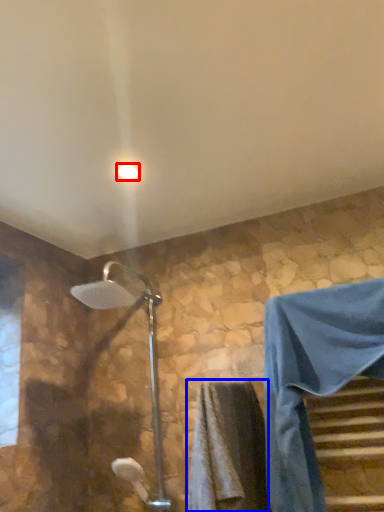
Question: Which point is further to the camera, light fixture (highlighted by a red box) or bath towel (highlighted by a blue box)?

Choices:
 (A) light fixture
 (B) bath towel

Answer: (A)